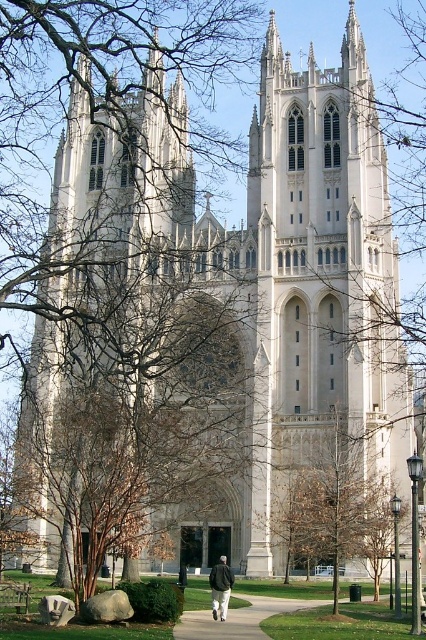
You are standing on the concrete sidewalk at lower center and want to walk towards the brown leafy tree at center. In which direction should you turn to face the tree?

The brown leafy tree at center is to the right of the concrete sidewalk at lower center, so you should turn to your right to face the tree.

You are a photographer standing in front of the cathedral. You want to take a photo that includes both the brown leafy tree at center and the dark gray jacket at center. Is there enough space between them to fit both in the frame without overlapping?

The brown leafy tree at center and the dark gray jacket at center are 8.44 meters apart from each other. Since the distance between them is significant, the photographer can easily fit both in the frame without overlapping.

You are standing at the entrance of the cathedral and see the concrete sidewalk at lower center and the dark gray jacket at center. Which object is positioned to the right of the other?

The concrete sidewalk at lower center is to the right of the dark gray jacket at center.